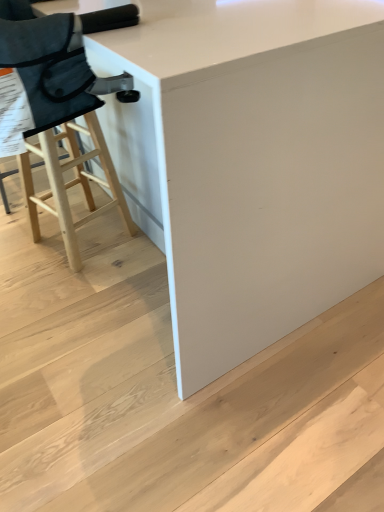
Locate an element on the screen. The height and width of the screenshot is (512, 384). natural wood stool at left is located at coordinates (58, 113).

Locate an element on the screen. The image size is (384, 512). natural wood stool at left is located at coordinates (58, 113).

Based on the photo, looking at their sizes, would you say natural wood stool at left is wider or thinner than white glossy table at center?

In the image, natural wood stool at left appears to be more narrow than white glossy table at center.

Is natural wood stool at left to the left of white glossy table at center from the viewer's perspective?

Indeed, natural wood stool at left is positioned on the left side of white glossy table at center.

How different are the orientations of natural wood stool at left and white glossy table at center in degrees?

natural wood stool at left and white glossy table at center are facing 4.94 degrees away from each other.

Measure the distance from natural wood stool at left to white glossy table at center.

natural wood stool at left is 32.68 inches from white glossy table at center.

Is white glossy table at center not near white matte stair at lower center?

Actually, white glossy table at center and white matte stair at lower center are a little close together.

Who is smaller, white glossy table at center or white matte stair at lower center?

Smaller between the two is white matte stair at lower center.

Relative to white matte stair at lower center, is white glossy table at center in front or behind?

In the image, white glossy table at center appears in front of white matte stair at lower center.

Locate an element on the screen. The width and height of the screenshot is (384, 512). stair that appears below the white glossy table at center (from the image's perspective) is located at coordinates (171, 391).

Can you confirm if white matte stair at lower center is positioned to the right of white glossy table at center?

Indeed, white matte stair at lower center is positioned on the right side of white glossy table at center.

Is point (16, 298) positioned behind point (164, 137)?

Yes.

Could you tell me if white matte stair at lower center is turned towards white glossy table at center?

Yes, white matte stair at lower center is facing white glossy table at center.

Looking at this image, can you confirm if white matte stair at lower center is thinner than white glossy table at center?

Incorrect, the width of white matte stair at lower center is not less than that of white glossy table at center.

Is white matte stair at lower center beside natural wood stool at left?

No.

Which is closer, (215, 388) or (55, 201)?

The point (215, 388) is closer.

The height and width of the screenshot is (512, 384). I want to click on chair lying behind the white matte stair at lower center, so click(58, 113).

How many degrees apart are the facing directions of white matte stair at lower center and natural wood stool at left?

The angular difference between white matte stair at lower center and natural wood stool at left is 5.14 degrees.

Identify the location of table above the natural wood stool at left (from the image's perspective). (260, 163).

Consider the image. From a real-world perspective, between white glossy table at center and natural wood stool at left, who is vertically lower?

From a 3D spatial view, natural wood stool at left is below.

Is white glossy table at center far from natural wood stool at left?

They are positioned close to each other.

Considering the points (222, 134) and (114, 180), which point is behind, point (222, 134) or point (114, 180)?

The point (114, 180) is farther.

Is natural wood stool at left bigger or smaller than white matte stair at lower center?

Considering their sizes, natural wood stool at left takes up less space than white matte stair at lower center.

From a real-world perspective, is natural wood stool at left physically below white matte stair at lower center?

No, from a real-world perspective, natural wood stool at left is not beneath white matte stair at lower center.

From the image's perspective, is natural wood stool at left on white matte stair at lower center?

Yes, from the image's perspective, natural wood stool at left is on top of white matte stair at lower center.

Which is in front, natural wood stool at left or white matte stair at lower center?

white matte stair at lower center is closer to the camera.

The width and height of the screenshot is (384, 512). I want to click on table that is above the natural wood stool at left (from a real-world perspective), so click(260, 163).

This screenshot has height=512, width=384. In order to click on table lying on the left of white matte stair at lower center in this screenshot , I will do `click(260, 163)`.

Estimate the real-world distances between objects in this image. Which object is closer to white glossy table at center, natural wood stool at left or white matte stair at lower center?

white matte stair at lower center is closer to white glossy table at center.

Estimate the real-world distances between objects in this image. Which object is closer to white matte stair at lower center, white glossy table at center or natural wood stool at left?

white glossy table at center is positioned closer to the anchor white matte stair at lower center.

Estimate the real-world distances between objects in this image. Which object is closer to white matte stair at lower center, natural wood stool at left or white glossy table at center?

white glossy table at center is closer to white matte stair at lower center.

Considering their positions, is white matte stair at lower center positioned further to white glossy table at center than natural wood stool at left?

The object further to white glossy table at center is natural wood stool at left.

Looking at the image, which one is located closer to natural wood stool at left, white glossy table at center or white matte stair at lower center?

white matte stair at lower center is closer to natural wood stool at left.

Which object lies nearer to the anchor point natural wood stool at left, white matte stair at lower center or white glossy table at center?

The object closer to natural wood stool at left is white matte stair at lower center.

At what (x,y) coordinates should I click in order to perform the action: click on chair between white glossy table at center and white matte stair at lower center vertically. Please return your answer as a coordinate pair (x, y). Image resolution: width=384 pixels, height=512 pixels. Looking at the image, I should click on (58, 113).